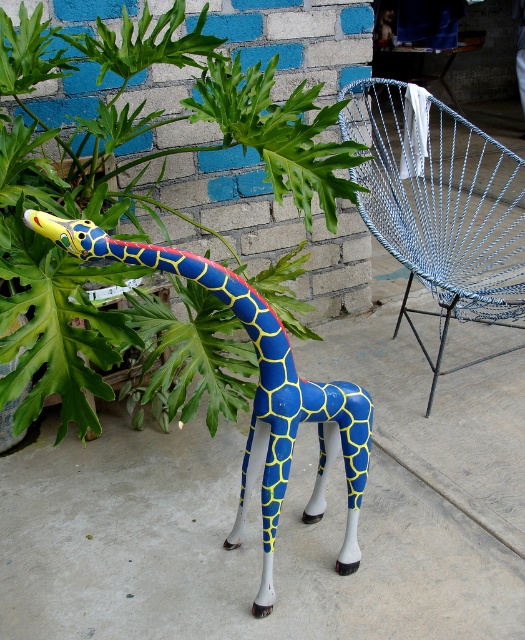
You are a painter standing in front of the giraffe sculpture. You want to place a green leafy plant at center and a blue woven wire chair at right in your painting. Which object should you paint first if you want to ensure the smaller object is completed before the larger one?

The green leafy plant at center has a smaller width than the blue woven wire chair at right, so you should paint the green leafy plant at center first to ensure the smaller object is completed before the larger one.

You are a gardener who wants to place a new small statue between the green leafy plant at center and the blue glossy giraffe at center. Since both are at the center, can you tell me which one is closer to the left side so you can position the statue appropriately?

The green leafy plant at center is larger in size than the blue glossy giraffe at center, so the statue should be placed to the left of the green leafy plant at center since it occupies more space on the left side.